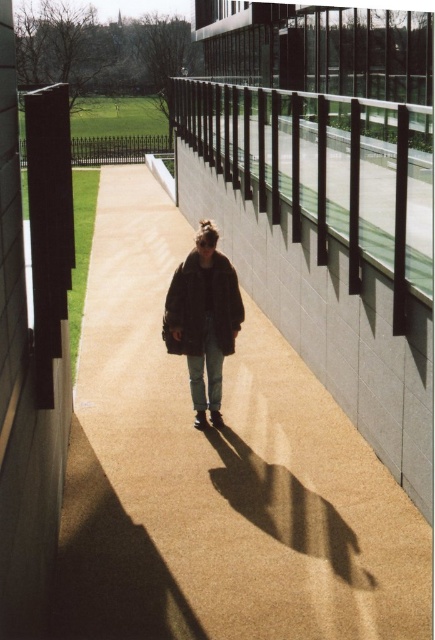
You are a delivery robot with a 1.5 meter wide package. You need to navigate through the pathway shown in the image. Can you pass through the space between the brown textured pavement at center and the dark brown leather jacket at center without hitting the package?

The distance between the brown textured pavement at center and the dark brown leather jacket at center is 1.42 meters. Since the package is 1.5 meters wide, it is wider than the available space. Therefore, the robot cannot pass through without hitting the package.

From the picture: You are a delivery robot positioned at the start of the pathway. Your task is to deliver a package to the building on the right. The brown textured pavement at center and the dark brown leather jacket at center are in your path. Which object should you navigate around first?

The brown textured pavement at center is in front of the dark brown leather jacket at center, so you should navigate around the dark brown leather jacket at center first since it is closer to your current position.

You are standing on the brown textured pavement at center and want to walk towards the building on the right. Can you pass through the area where the dark brown leather jacket at center is located?

The brown textured pavement at center might be wider than dark brown leather jacket at center, so there is a possibility that you can pass through the area where the dark brown leather jacket at center is located.